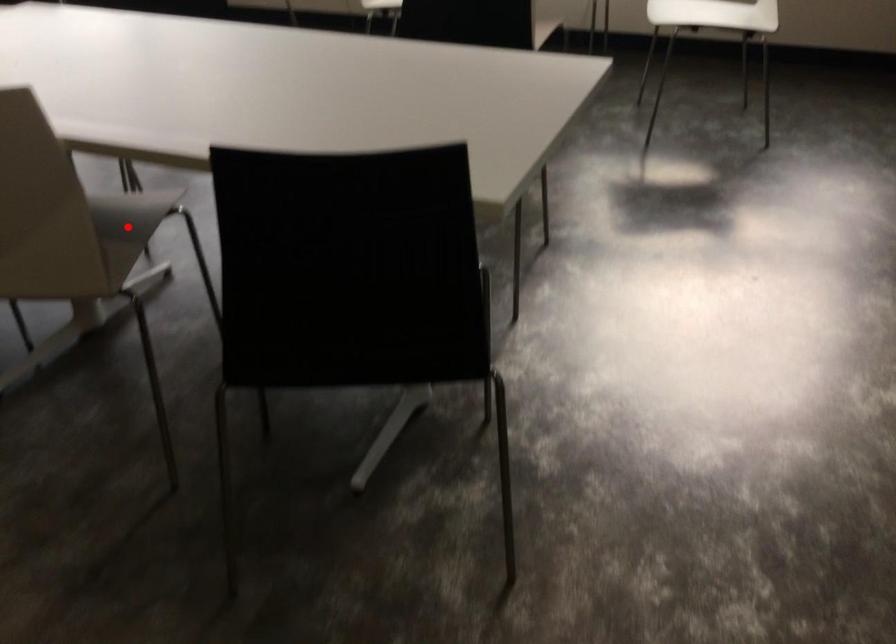
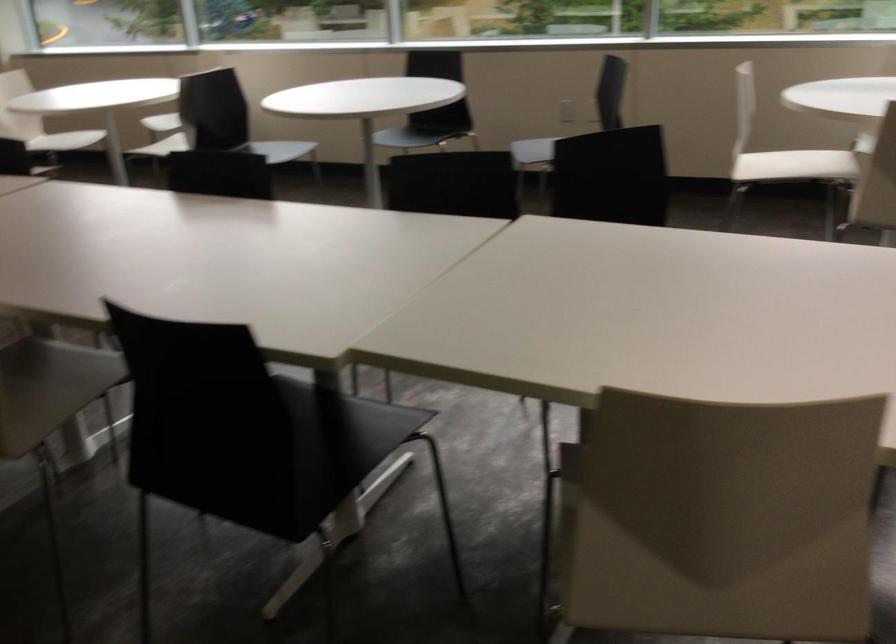
Question: I am providing you with two images of the same scene from different viewpoints. A red point is marked on the first image. At the location where the point appears in image 1, is it still visible in image 2?

Choices:
 (A) Yes
 (B) No

Answer: (B)